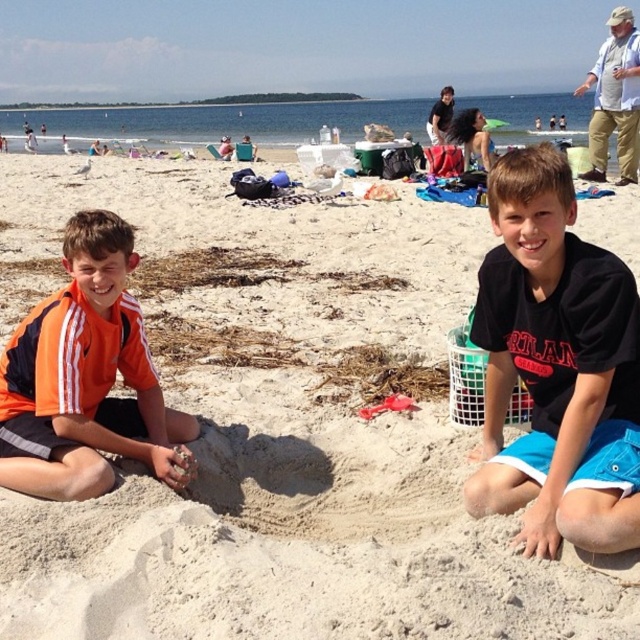
Does black cotton shirt at center have a lesser height compared to orange jersey at left?

In fact, black cotton shirt at center may be taller than orange jersey at left.

Image resolution: width=640 pixels, height=640 pixels. What do you see at coordinates (554, 356) in the screenshot?
I see `black cotton shirt at center` at bounding box center [554, 356].

Identify the location of black cotton shirt at center. The height and width of the screenshot is (640, 640). (554, 356).